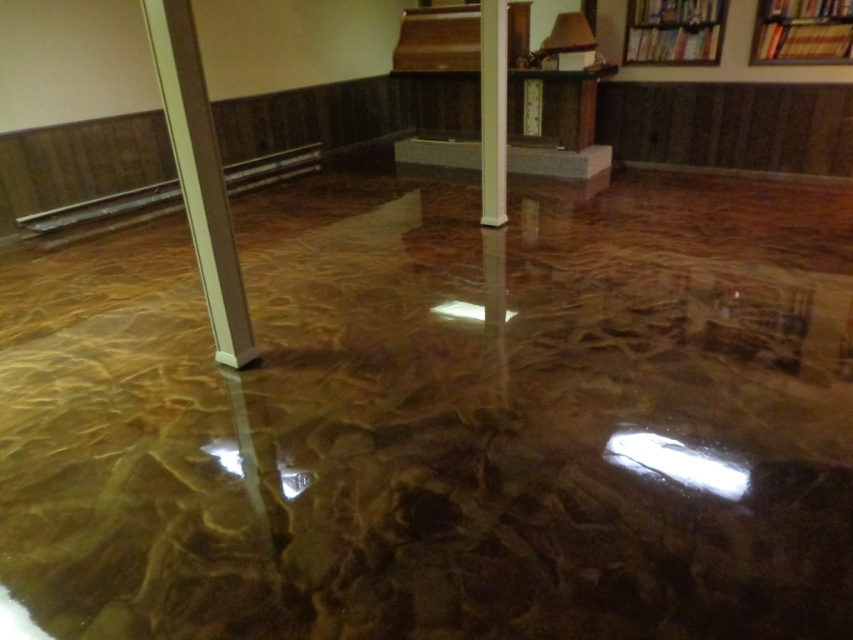
Question: Is metallic polished pillar at left above white glossy pillar at center?

Choices:
 (A) yes
 (B) no

Answer: (B)

Question: Which of these objects is positioned closest to the metallic polished pillar at left?

Choices:
 (A) brown wooden bookshelf at upper right
 (B) wooden bookshelf at upper right
 (C) white glossy pillar at center

Answer: (C)

Question: Which of the following is the farthest from the observer?

Choices:
 (A) brown wooden bookshelf at upper right
 (B) white glossy pillar at center
 (C) wooden bookshelf at upper right
 (D) metallic polished pillar at left

Answer: (A)

Question: Which point appears closest to the camera in this image?

Choices:
 (A) (775, 20)
 (B) (646, 0)
 (C) (155, 35)
 (D) (485, 180)

Answer: (C)

Question: Observing the image, what is the correct spatial positioning of metallic polished pillar at left in reference to white glossy pillar at center?

Choices:
 (A) below
 (B) above

Answer: (A)

Question: Does metallic polished pillar at left appear over wooden bookshelf at upper right?

Choices:
 (A) no
 (B) yes

Answer: (A)